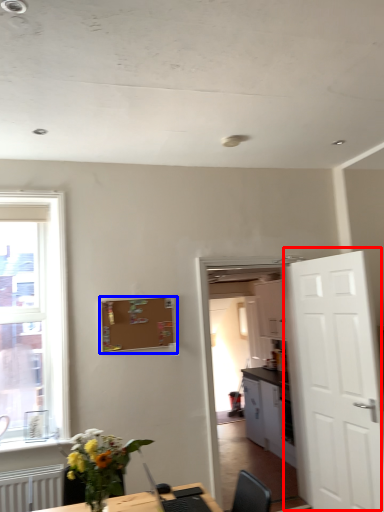
Question: Which point is closer to the camera, door (highlighted by a red box) or bulletin board (highlighted by a blue box)?

Choices:
 (A) door
 (B) bulletin board

Answer: (A)